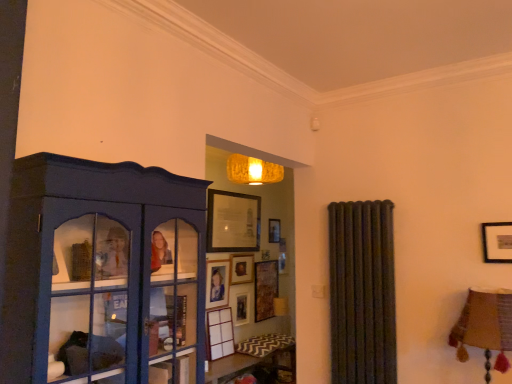
Question: Does wooden picture frame at upper center, arranged as the first picture frame when viewed from the top, have a larger size compared to matte blue cabinet at left?

Choices:
 (A) yes
 (B) no

Answer: (B)

Question: Does wooden picture frame at upper center, arranged as the first picture frame when viewed from the top, turn towards matte blue cabinet at left?

Choices:
 (A) no
 (B) yes

Answer: (A)

Question: Is wooden picture frame at upper center, arranged as the first picture frame when viewed from the top, further to the viewer compared to matte blue cabinet at left?

Choices:
 (A) yes
 (B) no

Answer: (A)

Question: Is wooden picture frame at upper center, which ranks as the 5th picture frame in bottom-to-top order, oriented away from matte blue cabinet at left?

Choices:
 (A) no
 (B) yes

Answer: (A)

Question: Considering the relative sizes of wooden picture frame at upper center, which ranks as the 5th picture frame in bottom-to-top order, and matte blue cabinet at left in the image provided, is wooden picture frame at upper center, which ranks as the 5th picture frame in bottom-to-top order, thinner than matte blue cabinet at left?

Choices:
 (A) yes
 (B) no

Answer: (A)

Question: Considering their positions, is wooden picture frame at upper center, which ranks as the 5th picture frame in bottom-to-top order, located in front of or behind matte blue cabinet at left?

Choices:
 (A) front
 (B) behind

Answer: (B)

Question: Is point (210, 200) positioned closer to the camera than point (9, 302)?

Choices:
 (A) farther
 (B) closer

Answer: (A)

Question: Visually, is wooden picture frame at upper center, which ranks as the 5th picture frame in bottom-to-top order, positioned to the left or to the right of matte blue cabinet at left?

Choices:
 (A) left
 (B) right

Answer: (B)

Question: From the image's perspective, is wooden picture frame at upper center, arranged as the first picture frame when viewed from the top, positioned above or below matte blue cabinet at left?

Choices:
 (A) below
 (B) above

Answer: (B)

Question: In terms of width, does matte black picture frame at center, the 3th picture frame from the bottom, look wider or thinner when compared to white matte picture frame at center, acting as the 5th picture frame starting from the top?

Choices:
 (A) wide
 (B) thin

Answer: (B)

Question: Is point (210, 291) positioned closer to the camera than point (229, 324)?

Choices:
 (A) closer
 (B) farther

Answer: (A)

Question: Considering the positions of matte black picture frame at center, the 3th picture frame from the bottom, and white matte picture frame at center, positioned as the 1th picture frame in bottom-to-top order, in the image, is matte black picture frame at center, the 3th picture frame from the bottom, bigger or smaller than white matte picture frame at center, positioned as the 1th picture frame in bottom-to-top order,?

Choices:
 (A) small
 (B) big

Answer: (A)

Question: Is matte black picture frame at center, the 3th picture frame from the bottom, to the left or to the right of white matte picture frame at center, positioned as the 1th picture frame in bottom-to-top order, in the image?

Choices:
 (A) left
 (B) right

Answer: (A)

Question: From their relative heights in the image, would you say matte blue cabinet at left is taller or shorter than wooden picture frame at upper center, which ranks as the 5th picture frame in bottom-to-top order?

Choices:
 (A) short
 (B) tall

Answer: (B)

Question: From the image's perspective, relative to wooden picture frame at upper center, which ranks as the 5th picture frame in bottom-to-top order, is matte blue cabinet at left above or below?

Choices:
 (A) above
 (B) below

Answer: (B)